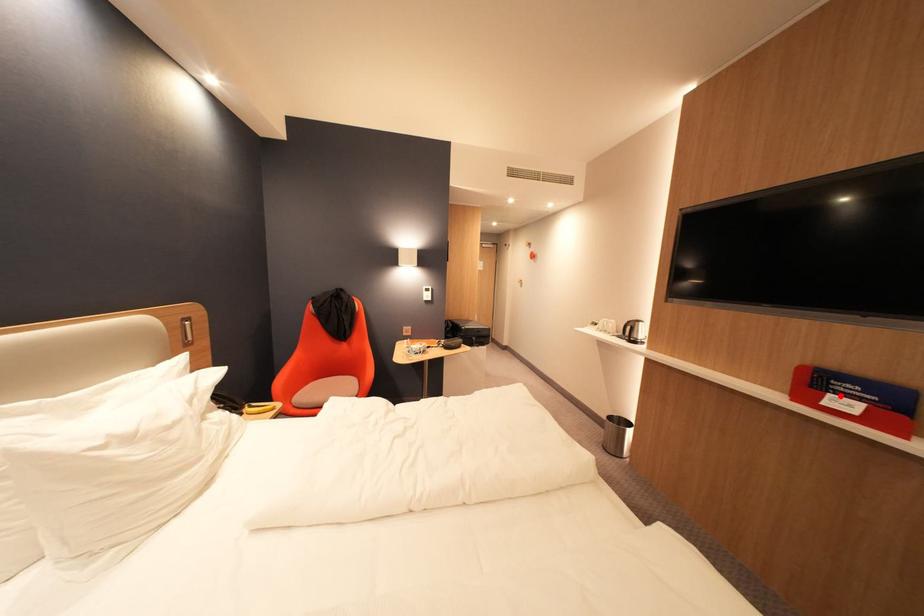
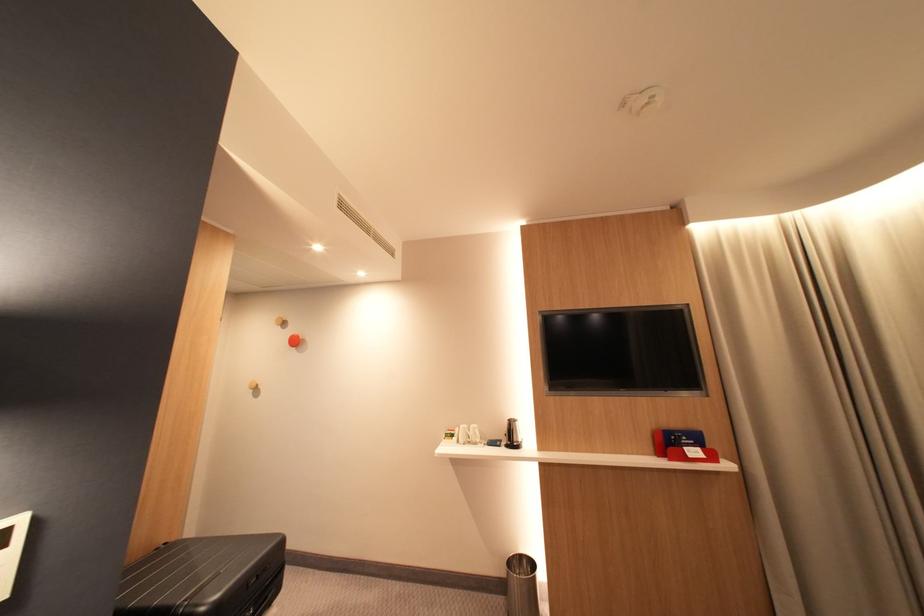
Locate, in the second image, the point that corresponds to the highlighted location in the first image.

(696, 450)